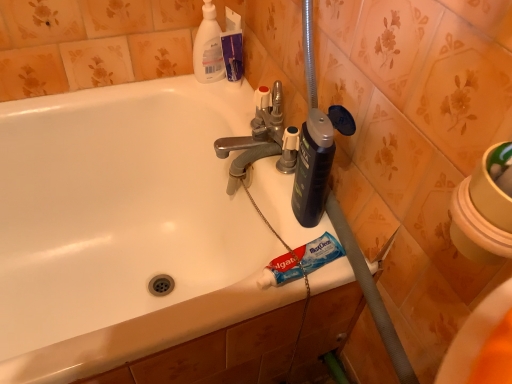
At what (x,y) coordinates should I click in order to perform the action: click on free location in front of white plastic bottle at upper center. Please return your answer as a coordinate pair (x, y). Looking at the image, I should click on (219, 107).